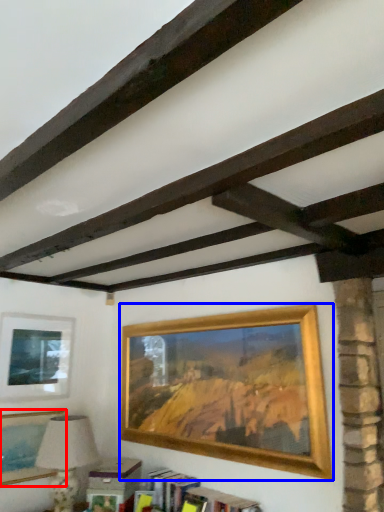
Question: Which point is further to the camera, picture frame (highlighted by a red box) or picture frame (highlighted by a blue box)?

Choices:
 (A) picture frame
 (B) picture frame

Answer: (A)